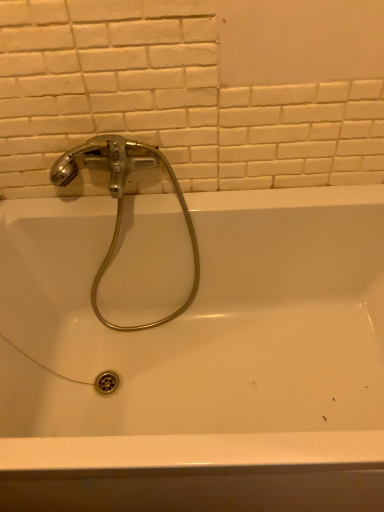
Question: Does white matte ceramic tile at upper center have a lesser height compared to white glossy bathtub at upper center?

Choices:
 (A) no
 (B) yes

Answer: (B)

Question: Does white matte ceramic tile at upper center contain white glossy bathtub at upper center?

Choices:
 (A) no
 (B) yes

Answer: (A)

Question: Is there a large distance between white matte ceramic tile at upper center and white glossy bathtub at upper center?

Choices:
 (A) no
 (B) yes

Answer: (A)

Question: Does white matte ceramic tile at upper center have a greater height compared to white glossy bathtub at upper center?

Choices:
 (A) no
 (B) yes

Answer: (A)

Question: Considering the relative positions of white matte ceramic tile at upper center and white glossy bathtub at upper center in the image provided, is white matte ceramic tile at upper center to the left of white glossy bathtub at upper center from the viewer's perspective?

Choices:
 (A) yes
 (B) no

Answer: (A)

Question: Looking at the image, does white matte ceramic tile at upper center seem bigger or smaller compared to white glossy bathtub at upper center?

Choices:
 (A) small
 (B) big

Answer: (A)

Question: From their relative heights in the image, would you say white matte ceramic tile at upper center is taller or shorter than white glossy bathtub at upper center?

Choices:
 (A) short
 (B) tall

Answer: (A)

Question: Is point (240, 65) closer or farther from the camera than point (64, 373)?

Choices:
 (A) farther
 (B) closer

Answer: (B)

Question: Would you say white matte ceramic tile at upper center is to the left or to the right of white glossy bathtub at upper center in the picture?

Choices:
 (A) left
 (B) right

Answer: (A)

Question: From a real-world perspective, relative to white matte ceramic tile at upper center, is polished chrome faucet at upper left vertically above or below?

Choices:
 (A) below
 (B) above

Answer: (A)

Question: From the image's perspective, relative to white matte ceramic tile at upper center, is polished chrome faucet at upper left above or below?

Choices:
 (A) below
 (B) above

Answer: (A)

Question: Based on their positions, is polished chrome faucet at upper left located to the left or right of white matte ceramic tile at upper center?

Choices:
 (A) right
 (B) left

Answer: (B)

Question: Is point (125, 140) closer or farther from the camera than point (1, 173)?

Choices:
 (A) closer
 (B) farther

Answer: (A)

Question: Is white matte ceramic tile at upper center inside or outside of polished chrome faucet at upper left?

Choices:
 (A) inside
 (B) outside

Answer: (B)

Question: Is white matte ceramic tile at upper center in front of or behind polished chrome faucet at upper left in the image?

Choices:
 (A) front
 (B) behind

Answer: (A)